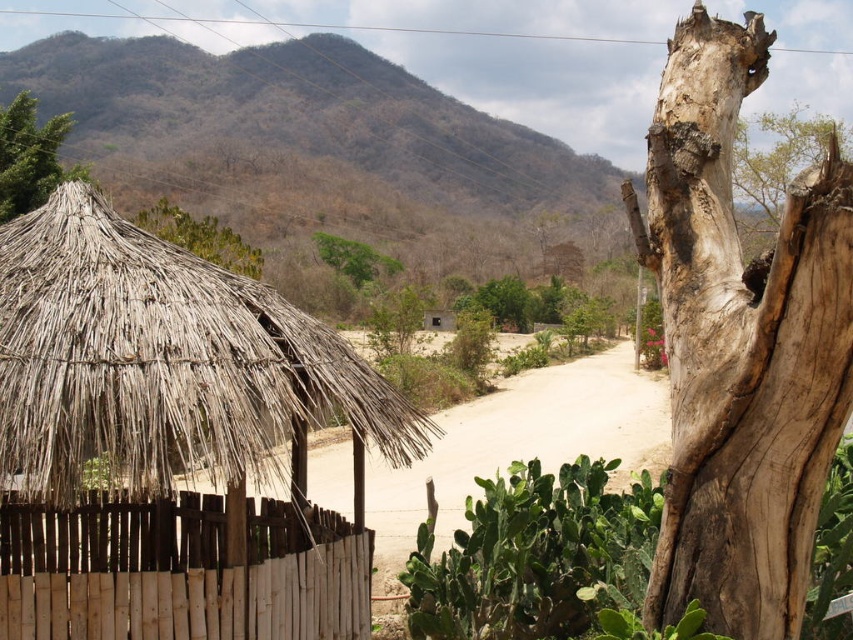
Question: Considering the relative positions of light brown rough bark at right and green leafy bush at upper center in the image provided, where is light brown rough bark at right located with respect to green leafy bush at upper center?

Choices:
 (A) above
 (B) below

Answer: (B)

Question: Which object is positioned farthest from the smooth brown bark at upper right?

Choices:
 (A) green leafy bush at upper center
 (B) light brown rough bark at right
 (C) thatched straw hut at left
 (D) green leafy tree at center

Answer: (D)

Question: Is green leafy tree at upper left above green leafy tree at center?

Choices:
 (A) yes
 (B) no

Answer: (A)

Question: Is smooth brown bark at upper right below green leafy bush at upper center?

Choices:
 (A) yes
 (B) no

Answer: (B)

Question: Which of these objects is positioned closest to the green spiny cactus at center?

Choices:
 (A) light brown rough bark at right
 (B) green leafy tree at upper left
 (C) brown wooden fence at left
 (D) smooth brown bark at upper right

Answer: (A)

Question: Among these points, which one is nearest to the camera?

Choices:
 (A) (231, 250)
 (B) (36, 326)
 (C) (341, 243)
 (D) (515, 561)

Answer: (B)